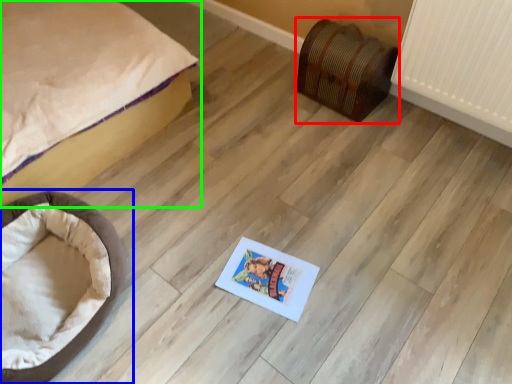
Question: Estimate the real-world distances between objects in this image. Which object is closer to furniture (highlighted by a red box), dog bed (highlighted by a blue box) or bed (highlighted by a green box)?

Choices:
 (A) dog bed
 (B) bed

Answer: (B)